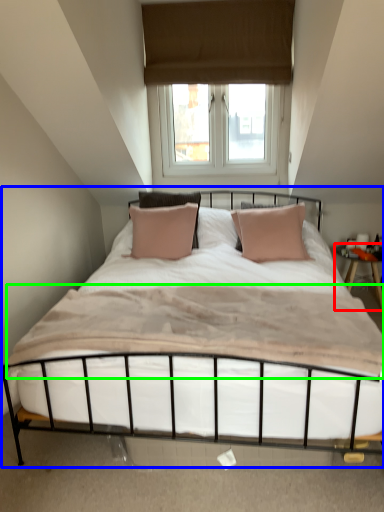
Question: Which object is the closest to the nightstand (highlighted by a red box)? Choose among these: bed (highlighted by a blue box) or mattress (highlighted by a green box).

Choices:
 (A) bed
 (B) mattress

Answer: (A)